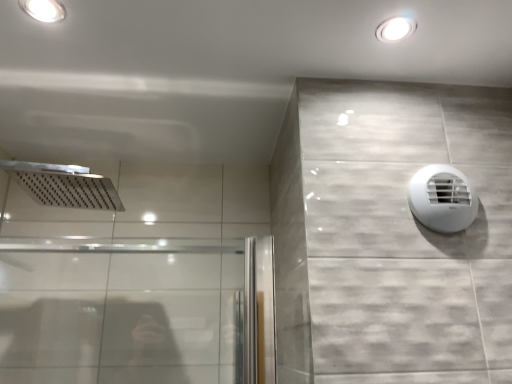
The image size is (512, 384). What do you see at coordinates (395, 29) in the screenshot?
I see `white glossy recessed light at upper right` at bounding box center [395, 29].

Find the location of `white glossy recessed light at upper right`. white glossy recessed light at upper right is located at coordinates (395, 29).

The image size is (512, 384). Find the location of `white glossy recessed light at upper right`. white glossy recessed light at upper right is located at coordinates (395, 29).